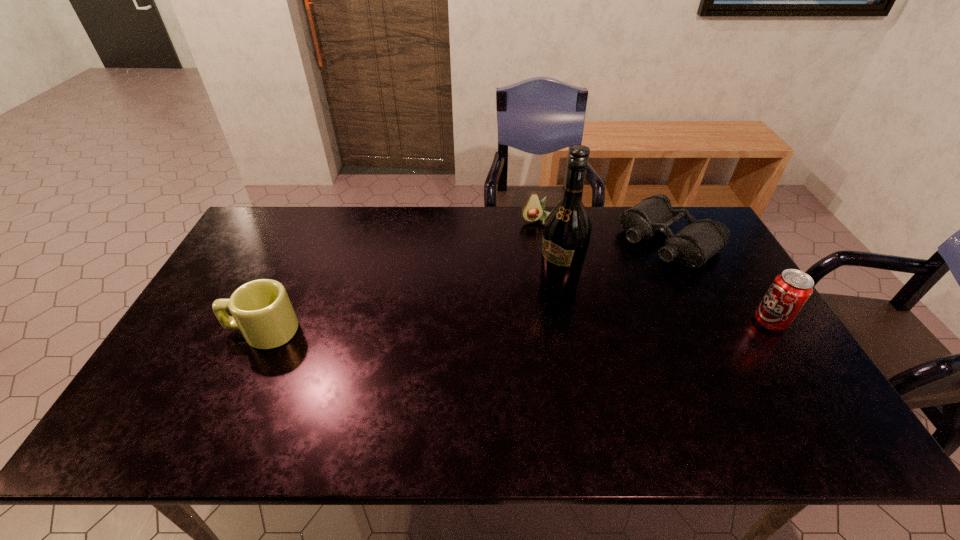
Image resolution: width=960 pixels, height=540 pixels. Identify the location of vacant space located through the eyepieces of the binoculars. (566, 313).

At what (x,y) coordinates should I click in order to perform the action: click on vacant region located on the seed side of the avocado. Please return your answer as a coordinate pair (x, y). Looking at the image, I should click on (558, 281).

Where is `vacant region located on the seed side of the avocado`? vacant region located on the seed side of the avocado is located at coordinates (545, 245).

Locate an element on the screen. The image size is (960, 540). free region located 0.330m on the seed side of the avocado is located at coordinates (562, 293).

Identify the location of vacant space located on the label of the wine bottle. This screenshot has height=540, width=960. (535, 309).

This screenshot has width=960, height=540. I want to click on vacant area situated on the label of the wine bottle, so click(535, 309).

This screenshot has height=540, width=960. I want to click on vacant position located on the label of the wine bottle, so click(486, 357).

This screenshot has width=960, height=540. Identify the location of binoculars that is at the far edge. (700, 240).

Locate an element on the screen. avocado at the far edge is located at coordinates (533, 210).

Identify the location of object at the left edge. click(261, 309).